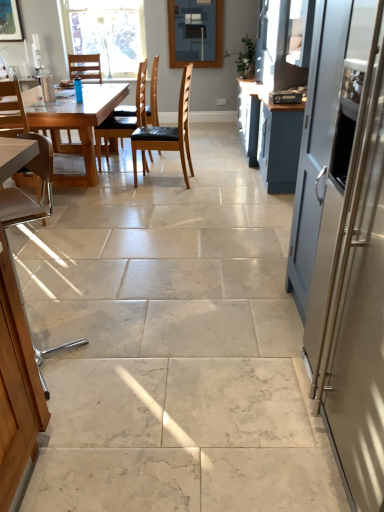
This screenshot has height=512, width=384. Identify the location of vacant space that is to the left of satin silver refrigerator at right. (216, 421).